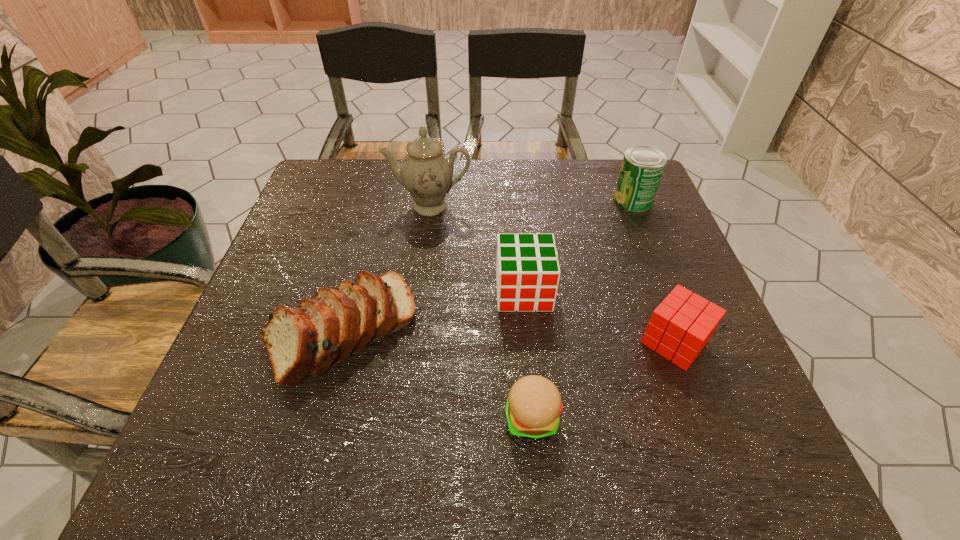
Image resolution: width=960 pixels, height=540 pixels. Find the location of `vacant region located 0.340m on the front of the can`. vacant region located 0.340m on the front of the can is located at coordinates (678, 312).

I want to click on vacant space situated 0.070m on the red face of the farther cube, so click(528, 340).

In order to click on free location located 0.190m on the right of the bread in this screenshot , I will do pyautogui.click(x=509, y=329).

The image size is (960, 540). What are the coordinates of `vacant space located 0.060m on the back of the nearer cube` in the screenshot? It's located at (657, 294).

The image size is (960, 540). What are the coordinates of `vacant space situated on the back of the shortest object` in the screenshot? It's located at (525, 332).

Where is `chinaware located at the far edge`? chinaware located at the far edge is located at coordinates (426, 171).

In order to click on can positioned at the far edge in this screenshot , I will do `click(642, 167)`.

The image size is (960, 540). Identify the location of object at the near edge. (534, 404).

You are a GUI agent. You are given a task and a screenshot of the screen. Output one action in this format:
    pyautogui.click(x=<x>, y=<y>)
    Task: Click on the object that is at the left edge
    This screenshot has width=960, height=540.
    Given the screenshot: What is the action you would take?
    pyautogui.click(x=302, y=343)

Locate an element on the screen. The width and height of the screenshot is (960, 540). can present at the right edge is located at coordinates (642, 167).